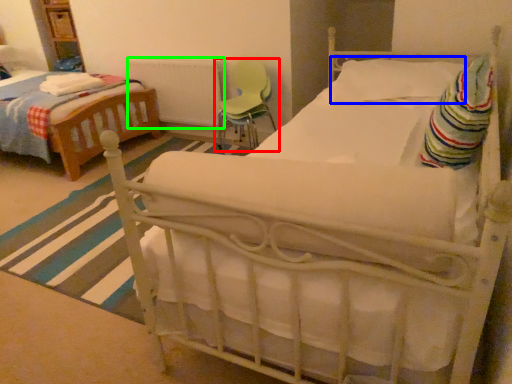
Question: Which object is positioned farthest from chair (highlighted by a red box)? Select from pillow (highlighted by a blue box) and radiator (highlighted by a green box).

Choices:
 (A) pillow
 (B) radiator

Answer: (A)